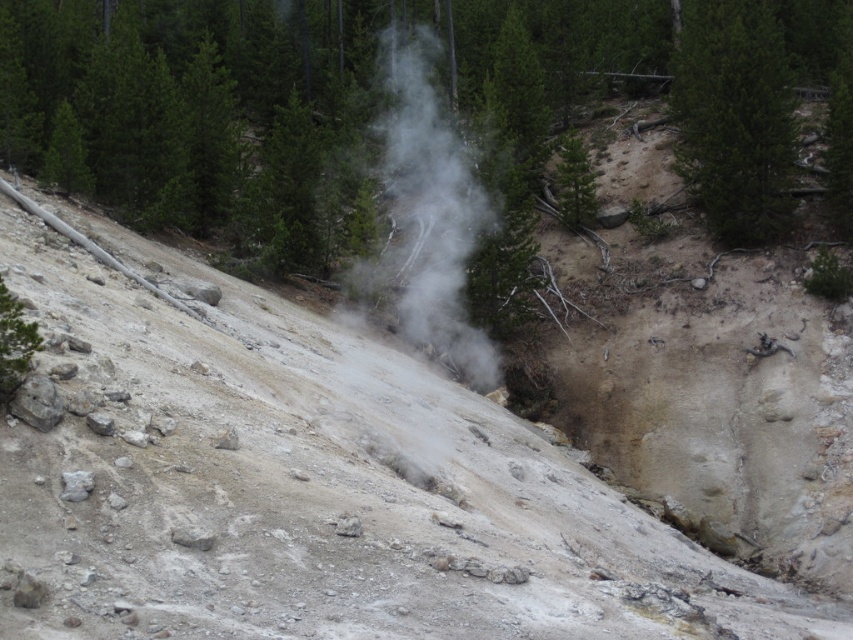
How far apart are white vapor at center and green matte tree at upper right?

The distance of white vapor at center from green matte tree at upper right is 8.97 meters.

What do you see at coordinates (427, 221) in the screenshot?
I see `white vapor at center` at bounding box center [427, 221].

At what (x,y) coordinates should I click in order to perform the action: click on white vapor at center. Please return your answer as a coordinate pair (x, y). The image size is (853, 640). Looking at the image, I should click on (427, 221).

Which of these two, dull gray rock at center or green matte tree at upper right, stands shorter?

dull gray rock at center

Measure the distance between dull gray rock at center and camera.

dull gray rock at center is 8.42 meters away from camera.

Identify the location of dull gray rock at center. (310, 483).

The width and height of the screenshot is (853, 640). What do you see at coordinates (310, 483) in the screenshot?
I see `dull gray rock at center` at bounding box center [310, 483].

Who is more distant from viewer, (28,486) or (363,291)?

Positioned behind is point (363,291).

The image size is (853, 640). What are the coordinates of `dull gray rock at center` in the screenshot? It's located at (310, 483).